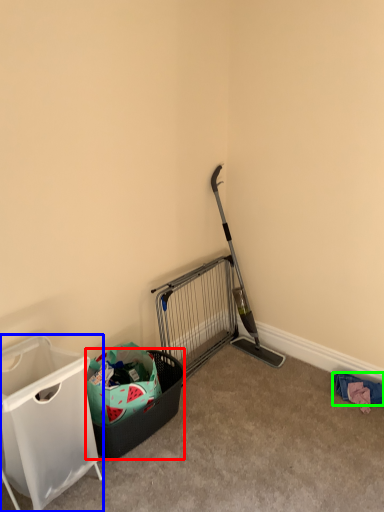
Question: Based on their relative distances, which object is nearer to shopping basket (highlighted by a red box)? Choose from waste container (highlighted by a blue box) and clothing (highlighted by a green box).

Choices:
 (A) waste container
 (B) clothing

Answer: (A)